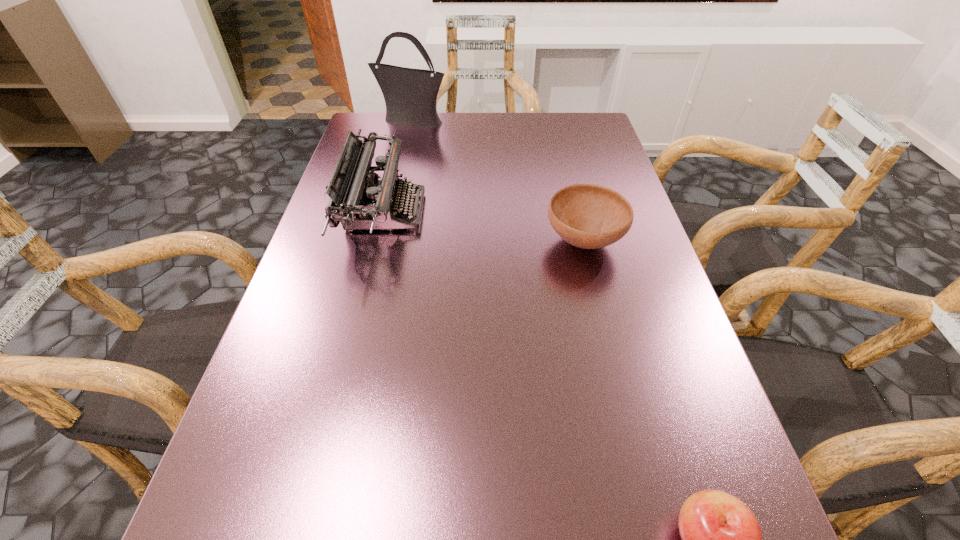
What are the coordinates of `vacant region that satisfies the following two spatial constraints: 1. on the front side of the shoulder bag; 2. on the right side of the bowl` in the screenshot? It's located at (384, 241).